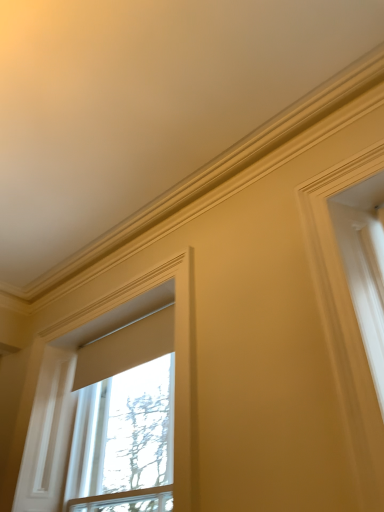
Question: Which direction should I rotate to face matte beige window at center, which ranks as the 1th window in right-to-left order, — up or down?

Choices:
 (A) down
 (B) up

Answer: (A)

Question: Can you confirm if matte beige window at center, which ranks as the 1th window in right-to-left order, is positioned to the right of matte white shade at upper left, which is counted as the 2th window, starting from the right?

Choices:
 (A) no
 (B) yes

Answer: (B)

Question: Considering the relative sizes of matte beige window at center, which ranks as the 1th window in right-to-left order, and matte white shade at upper left, which is the first window from left to right, in the image provided, is matte beige window at center, which ranks as the 1th window in right-to-left order, wider than matte white shade at upper left, which is the first window from left to right,?

Choices:
 (A) yes
 (B) no

Answer: (A)

Question: Is matte beige window at center, which ranks as the 2th window in left-to-right order, bigger than matte white shade at upper left, which is counted as the 2th window, starting from the right?

Choices:
 (A) yes
 (B) no

Answer: (A)

Question: Is matte beige window at center, which ranks as the 2th window in left-to-right order, outside matte white shade at upper left, which is counted as the 2th window, starting from the right?

Choices:
 (A) yes
 (B) no

Answer: (A)

Question: Considering the relative sizes of matte beige window at center, which ranks as the 2th window in left-to-right order, and matte white shade at upper left, which is the first window from left to right, in the image provided, is matte beige window at center, which ranks as the 2th window in left-to-right order, smaller than matte white shade at upper left, which is the first window from left to right,?

Choices:
 (A) yes
 (B) no

Answer: (B)

Question: Does matte beige window at center, which ranks as the 2th window in left-to-right order, have a greater height compared to matte white shade at upper left, which is counted as the 2th window, starting from the right?

Choices:
 (A) no
 (B) yes

Answer: (A)

Question: Is the depth of matte white shade at upper left, which is the first window from left to right, greater than that of matte beige window at center, which ranks as the 2th window in left-to-right order?

Choices:
 (A) yes
 (B) no

Answer: (B)

Question: From a real-world perspective, does matte white shade at upper left, which is the first window from left to right, sit lower than matte beige window at center, which ranks as the 2th window in left-to-right order?

Choices:
 (A) no
 (B) yes

Answer: (A)

Question: Considering the relative sizes of matte white shade at upper left, which is the first window from left to right, and matte beige window at center, which ranks as the 2th window in left-to-right order, in the image provided, is matte white shade at upper left, which is the first window from left to right, bigger than matte beige window at center, which ranks as the 2th window in left-to-right order,?

Choices:
 (A) no
 (B) yes

Answer: (A)

Question: Is the position of matte white shade at upper left, which is counted as the 2th window, starting from the right, less distant than that of matte beige window at center, which ranks as the 2th window in left-to-right order?

Choices:
 (A) no
 (B) yes

Answer: (B)

Question: Does matte white shade at upper left, which is the first window from left to right, turn towards matte beige window at center, which ranks as the 1th window in right-to-left order?

Choices:
 (A) no
 (B) yes

Answer: (B)

Question: Is matte white shade at upper left, which is counted as the 2th window, starting from the right, taller than matte beige window at center, which ranks as the 1th window in right-to-left order?

Choices:
 (A) no
 (B) yes

Answer: (B)

Question: Considering the positions of matte beige window at center, which ranks as the 2th window in left-to-right order, and matte white shade at upper left, which is the first window from left to right, in the image, is matte beige window at center, which ranks as the 2th window in left-to-right order, taller or shorter than matte white shade at upper left, which is the first window from left to right,?

Choices:
 (A) tall
 (B) short

Answer: (B)